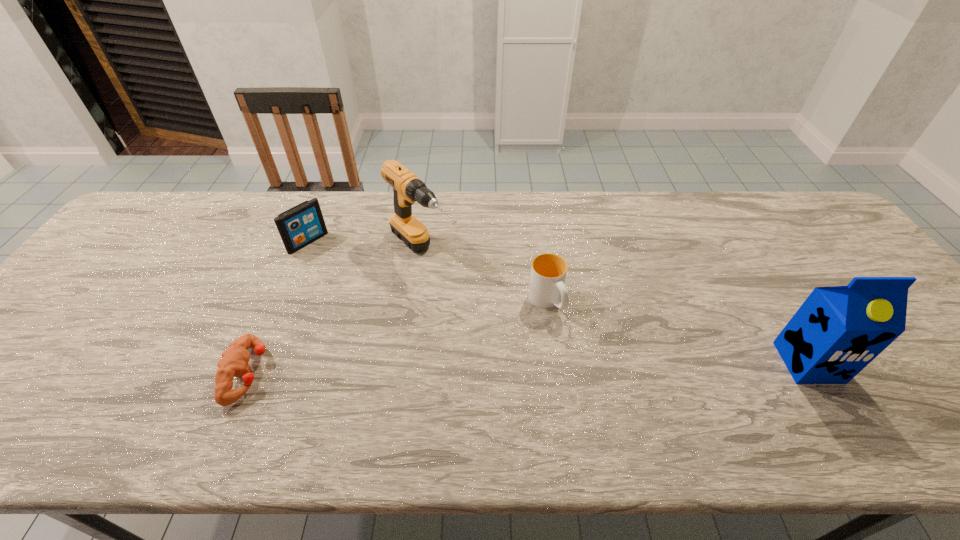
Locate an element on the screen. This screenshot has height=540, width=960. vacant spot on the desktop that is between the shortest object and the rightmost object and is positioned at the tip of the drill is located at coordinates [x=554, y=367].

What are the coordinates of `free spot on the desktop that is between the puncher and the carton and is positioned on the front screen of the iPod` in the screenshot? It's located at (467, 369).

Identify the location of free space on the desktop that is between the shortest object and the carton and is positioned with the handle on the side of the cup. (591, 367).